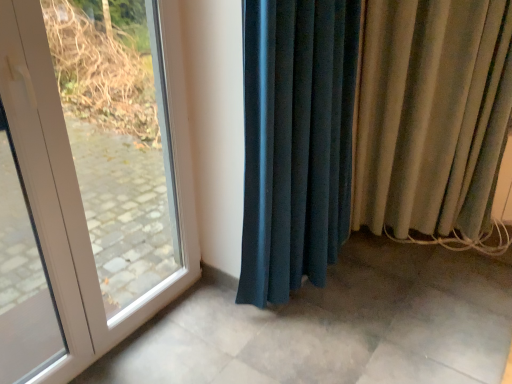
Identify the location of velvet teal curtain at center, positioned as the 1th curtain in left-to-right order. (296, 142).

The image size is (512, 384). In order to click on velvet teal curtain at center, the 2th curtain viewed from the right in this screenshot , I will do `click(296, 142)`.

Between white glossy door at left and velvet teal curtain at center, positioned as the 1th curtain in left-to-right order, which one has smaller width?

white glossy door at left.

How many degrees apart are the facing directions of white glossy door at left and velvet teal curtain at center, positioned as the 1th curtain in left-to-right order?

white glossy door at left and velvet teal curtain at center, positioned as the 1th curtain in left-to-right order, are facing 2.11 degrees away from each other.

From the image's perspective, is white glossy door at left beneath velvet teal curtain at center, the 2th curtain viewed from the right?

Correct, white glossy door at left appears lower than velvet teal curtain at center, the 2th curtain viewed from the right, in the image.

Locate an element on the screen. The height and width of the screenshot is (384, 512). door on the left of velvet teal curtain at center, positioned as the 1th curtain in left-to-right order is located at coordinates [x=88, y=187].

Which object is further away from the camera taking this photo, beige velvet curtain at right, the second curtain from the left, or velvet teal curtain at center, positioned as the 1th curtain in left-to-right order?

beige velvet curtain at right, the second curtain from the left, is further away from the camera.

Is beige velvet curtain at right, which is the first curtain from right to left, to the right of velvet teal curtain at center, the 2th curtain viewed from the right, from the viewer's perspective?

Yes.

Is point (374, 162) closer or farther from the camera than point (281, 188)?

Point (374, 162) is farther from the camera than point (281, 188).

What's the angular difference between beige velvet curtain at right, the second curtain from the left, and velvet teal curtain at center, the 2th curtain viewed from the right,'s facing directions?

They differ by 57 degrees in their facing directions.

Is beige velvet curtain at right, which is the first curtain from right to left, touching white glossy door at left?

No, beige velvet curtain at right, which is the first curtain from right to left, is not touching white glossy door at left.

Is beige velvet curtain at right, which is the first curtain from right to left, oriented away from white glossy door at left?

No, beige velvet curtain at right, which is the first curtain from right to left,'s orientation is not away from white glossy door at left.

Is beige velvet curtain at right, the second curtain from the left, wider or thinner than white glossy door at left?

Clearly, beige velvet curtain at right, the second curtain from the left, has more width compared to white glossy door at left.

From a real-world perspective, between beige velvet curtain at right, which is the first curtain from right to left, and white glossy door at left, who is vertically higher?

white glossy door at left is physically above.

Considering the relative sizes of velvet teal curtain at center, the 2th curtain viewed from the right, and beige velvet curtain at right, the second curtain from the left, in the image provided, is velvet teal curtain at center, the 2th curtain viewed from the right, taller than beige velvet curtain at right, the second curtain from the left,?

Yes, velvet teal curtain at center, the 2th curtain viewed from the right, is taller than beige velvet curtain at right, the second curtain from the left.

How different are the orientations of velvet teal curtain at center, the 2th curtain viewed from the right, and beige velvet curtain at right, which is the first curtain from right to left, in degrees?

57 degrees.

Does velvet teal curtain at center, positioned as the 1th curtain in left-to-right order, come in front of beige velvet curtain at right, the second curtain from the left?

Yes, the depth of velvet teal curtain at center, positioned as the 1th curtain in left-to-right order, is less than that of beige velvet curtain at right, the second curtain from the left.

Could you tell me if velvet teal curtain at center, positioned as the 1th curtain in left-to-right order, is facing beige velvet curtain at right, which is the first curtain from right to left?

No, velvet teal curtain at center, positioned as the 1th curtain in left-to-right order, is not turned towards beige velvet curtain at right, which is the first curtain from right to left.

From the image's perspective, is velvet teal curtain at center, the 2th curtain viewed from the right, positioned above or below white glossy door at left?

Clearly, from the image's perspective, velvet teal curtain at center, the 2th curtain viewed from the right, is above white glossy door at left.

Considering the sizes of objects velvet teal curtain at center, the 2th curtain viewed from the right, and white glossy door at left in the image provided, who is smaller, velvet teal curtain at center, the 2th curtain viewed from the right, or white glossy door at left?

white glossy door at left is smaller.

Considering the positions of objects velvet teal curtain at center, positioned as the 1th curtain in left-to-right order, and white glossy door at left in the image provided, who is more to the right, velvet teal curtain at center, positioned as the 1th curtain in left-to-right order, or white glossy door at left?

velvet teal curtain at center, positioned as the 1th curtain in left-to-right order, is more to the right.

Is velvet teal curtain at center, positioned as the 1th curtain in left-to-right order, surrounding white glossy door at left?

That's incorrect, white glossy door at left is not inside velvet teal curtain at center, positioned as the 1th curtain in left-to-right order.

Which object is closer to the camera, white glossy door at left or beige velvet curtain at right, which is the first curtain from right to left?

white glossy door at left is in front.

Locate an element on the screen. The height and width of the screenshot is (384, 512). door in front of the beige velvet curtain at right, the second curtain from the left is located at coordinates (88, 187).

Which of these two, white glossy door at left or beige velvet curtain at right, the second curtain from the left, is thinner?

white glossy door at left.

From a real-world perspective, is white glossy door at left positioned over beige velvet curtain at right, the second curtain from the left, based on gravity?

Yes, from a real-world perspective, white glossy door at left is over beige velvet curtain at right, the second curtain from the left

This screenshot has width=512, height=384. Find the location of `door above the velvet teal curtain at center, positioned as the 1th curtain in left-to-right order (from a real-world perspective)`. door above the velvet teal curtain at center, positioned as the 1th curtain in left-to-right order (from a real-world perspective) is located at coordinates (88, 187).

The width and height of the screenshot is (512, 384). What are the coordinates of `curtain lying in front of the beige velvet curtain at right, which is the first curtain from right to left` in the screenshot? It's located at (296, 142).

From the image, which object appears to be nearer to white glossy door at left, velvet teal curtain at center, positioned as the 1th curtain in left-to-right order, or beige velvet curtain at right, the second curtain from the left?

velvet teal curtain at center, positioned as the 1th curtain in left-to-right order, lies closer to white glossy door at left than the other object.

Looking at the image, which one is located further to velvet teal curtain at center, the 2th curtain viewed from the right, beige velvet curtain at right, the second curtain from the left, or white glossy door at left?

white glossy door at left.

Which object lies nearer to the anchor point beige velvet curtain at right, the second curtain from the left, velvet teal curtain at center, the 2th curtain viewed from the right, or white glossy door at left?

Based on the image, velvet teal curtain at center, the 2th curtain viewed from the right, appears to be nearer to beige velvet curtain at right, the second curtain from the left.

Estimate the real-world distances between objects in this image. Which object is closer to white glossy door at left, beige velvet curtain at right, which is the first curtain from right to left, or velvet teal curtain at center, positioned as the 1th curtain in left-to-right order?

Among the two, velvet teal curtain at center, positioned as the 1th curtain in left-to-right order, is located nearer to white glossy door at left.

Considering their positions, is white glossy door at left positioned closer to beige velvet curtain at right, which is the first curtain from right to left, than velvet teal curtain at center, positioned as the 1th curtain in left-to-right order?

Based on the image, velvet teal curtain at center, positioned as the 1th curtain in left-to-right order, appears to be nearer to beige velvet curtain at right, which is the first curtain from right to left.

Consider the image. When comparing their distances from velvet teal curtain at center, the 2th curtain viewed from the right, does white glossy door at left or beige velvet curtain at right, the second curtain from the left, seem further?

white glossy door at left.

You are a GUI agent. You are given a task and a screenshot of the screen. Output one action in this format:
    pyautogui.click(x=<x>, y=<y>)
    Task: Click on the curtain situated between white glossy door at left and beige velvet curtain at right, the second curtain from the left, from left to right
    The width and height of the screenshot is (512, 384).
    Given the screenshot: What is the action you would take?
    pyautogui.click(x=296, y=142)